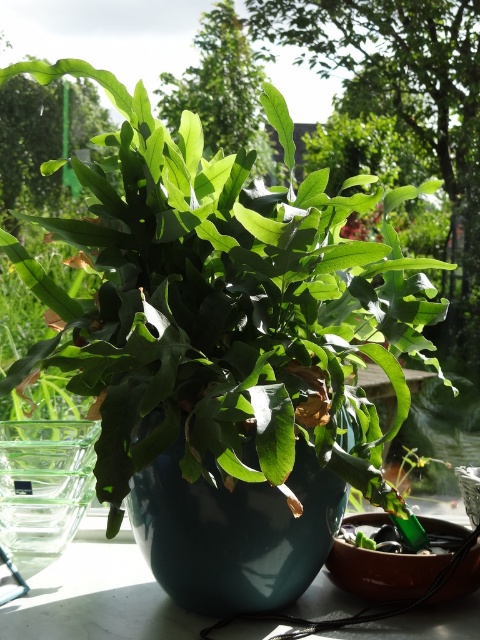
Question: Which object is closer to the camera taking this photo?

Choices:
 (A) matte blue vase at center
 (B) transparent glass vase at left
 (C) matte green leafy plant at center
 (D) white marble table at center

Answer: (C)

Question: Considering the relative positions of matte green leafy plant at center and matte blue vase at center in the image provided, where is matte green leafy plant at center located with respect to matte blue vase at center?

Choices:
 (A) left
 (B) right

Answer: (B)

Question: Which object is positioned closest to the white marble table at center?

Choices:
 (A) transparent glass vase at left
 (B) matte blue vase at center
 (C) matte green leafy plant at center

Answer: (B)

Question: Can you confirm if matte blue vase at center is positioned below transparent glass vase at left?

Choices:
 (A) no
 (B) yes

Answer: (A)

Question: Does matte blue vase at center appear under transparent glass vase at left?

Choices:
 (A) no
 (B) yes

Answer: (A)

Question: Which of the following is the farthest from the observer?

Choices:
 (A) matte blue vase at center
 (B) white marble table at center
 (C) transparent glass vase at left
 (D) matte green leafy plant at center

Answer: (C)